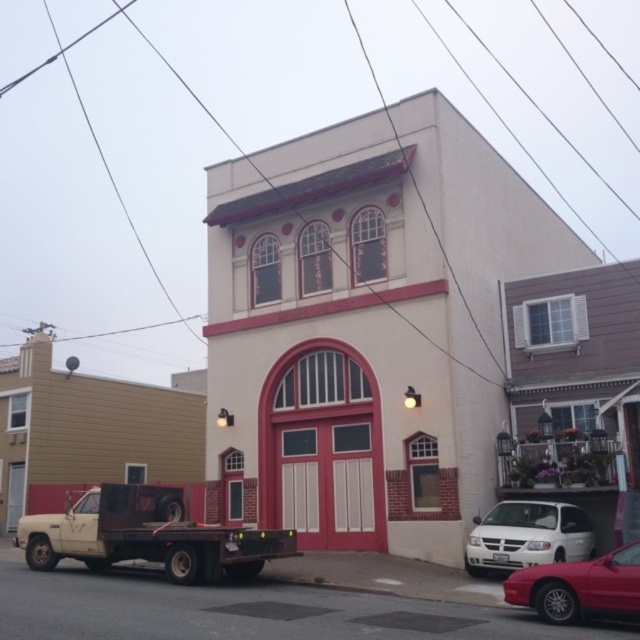
Question: Considering the real-world distances, which object is farthest from the shiny red sedan at lower right?

Choices:
 (A) white matte van at lower right
 (B) beige matte flatbed truck at lower left

Answer: (B)

Question: Can you confirm if beige matte flatbed truck at lower left is positioned to the left of white matte van at lower right?

Choices:
 (A) no
 (B) yes

Answer: (B)

Question: Which of the following is the farthest from the observer?

Choices:
 (A) (118, 518)
 (B) (552, 532)

Answer: (A)

Question: Estimate the real-world distances between objects in this image. Which object is closer to the shiny red sedan at lower right?

Choices:
 (A) beige matte flatbed truck at lower left
 (B) white matte van at lower right

Answer: (B)

Question: In this image, where is beige matte flatbed truck at lower left located relative to shiny red sedan at lower right?

Choices:
 (A) above
 (B) below

Answer: (B)

Question: Is shiny red sedan at lower right above white matte van at lower right?

Choices:
 (A) yes
 (B) no

Answer: (A)